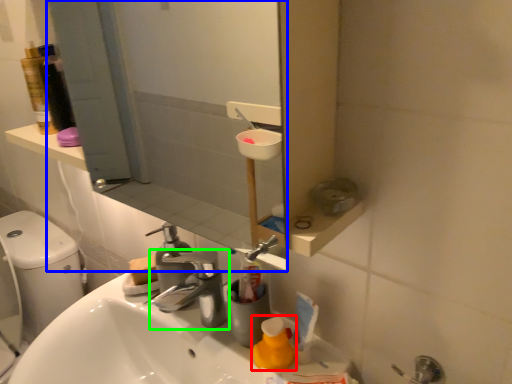
Question: Which object is the closest to the cleaning product (highlighted by a red box)? Choose among these: mirror (highlighted by a blue box) or tap (highlighted by a green box).

Choices:
 (A) mirror
 (B) tap

Answer: (B)